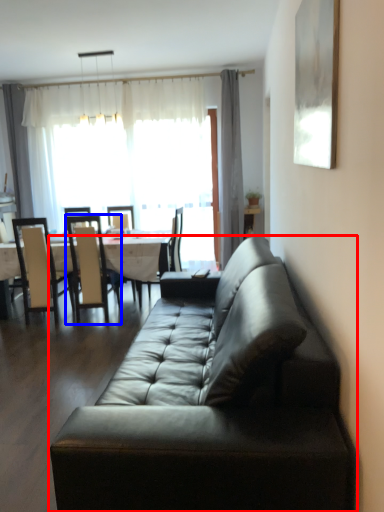
Question: Among these objects, which one is nearest to the camera, studio couch (highlighted by a red box) or chair (highlighted by a blue box)?

Choices:
 (A) studio couch
 (B) chair

Answer: (A)